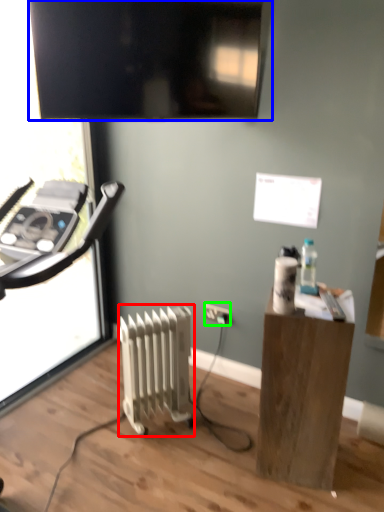
Question: Based on their relative distances, which object is nearer to radiator (highlighted by a red box)? Choose from television (highlighted by a blue box) and electric outlet (highlighted by a green box).

Choices:
 (A) television
 (B) electric outlet

Answer: (B)